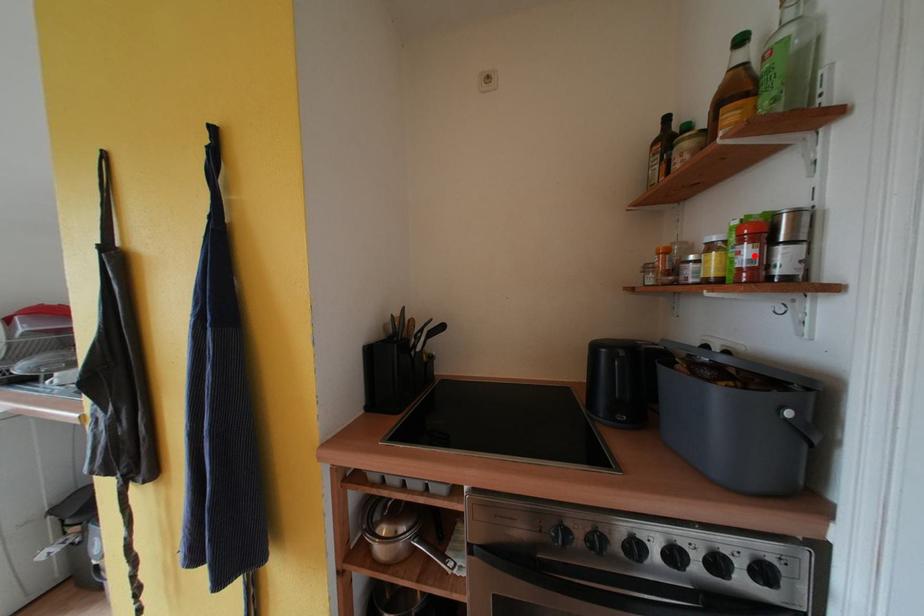
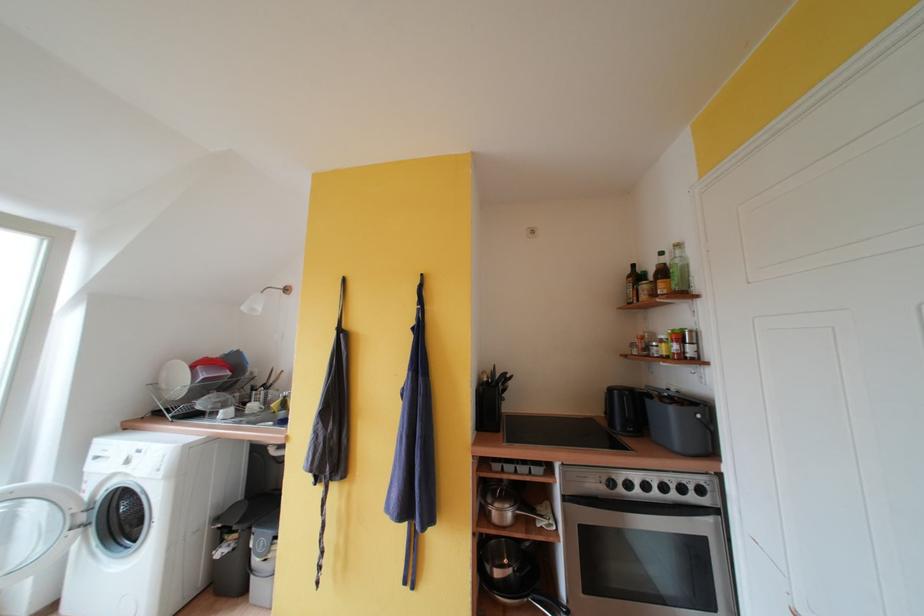
Where in the second image is the point corresponding to the highlighted location from the first image?

(682, 350)